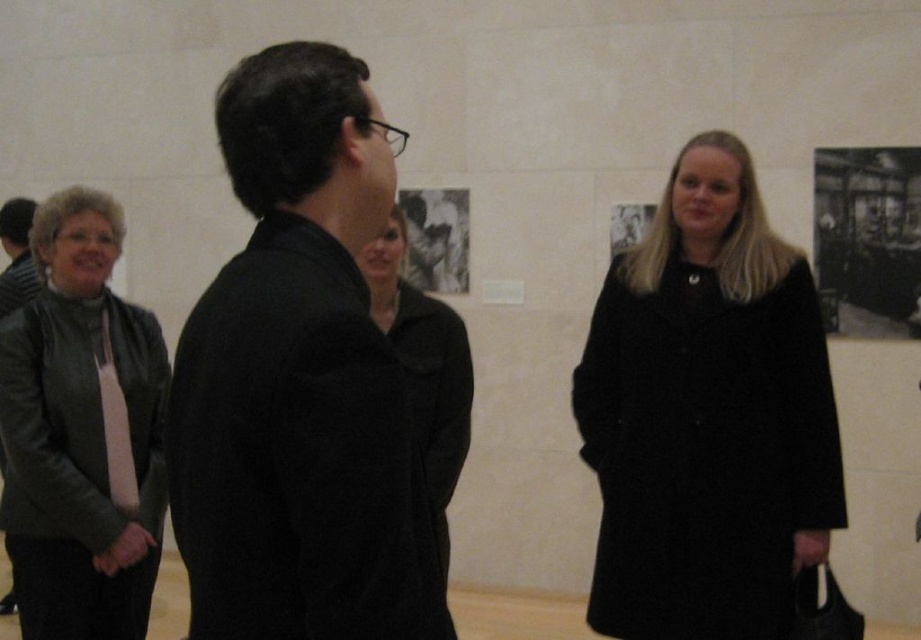
Is point (249, 264) more distant than point (603, 486)?

No.

Is black matte jacket at center above black wool coat at right?

Indeed, black matte jacket at center is positioned over black wool coat at right.

Which is in front, point (288, 115) or point (750, 484)?

Positioned in front is point (288, 115).

Where is `black matte jacket at center`? This screenshot has height=640, width=921. black matte jacket at center is located at coordinates (300, 380).

Does point (162, 401) come in front of point (376, 288)?

No, (162, 401) is further to viewer.

Is point (52, 541) more distant than point (462, 442)?

No, (52, 541) is in front of (462, 442).

Which is in front, point (41, 512) or point (461, 388)?

Positioned in front is point (41, 512).

What are the coordinates of `leather jacket at left` in the screenshot? It's located at (80, 433).

Between black matte jacket at center and leather jacket at left, which one has less height?

black matte jacket at center

What do you see at coordinates (300, 380) in the screenshot? I see `black matte jacket at center` at bounding box center [300, 380].

Identify the location of black matte jacket at center. (300, 380).